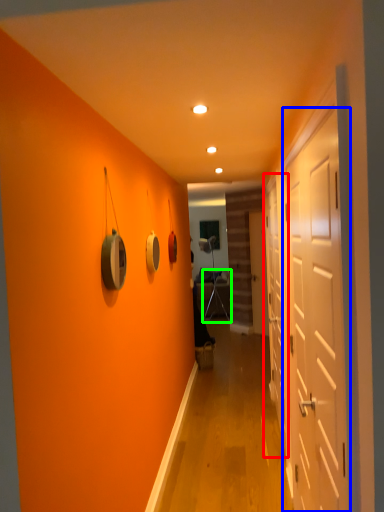
Question: Which is farther away from door (highlighted by a red box)? door (highlighted by a blue box) or armchair (highlighted by a green box)?

Choices:
 (A) door
 (B) armchair

Answer: (B)